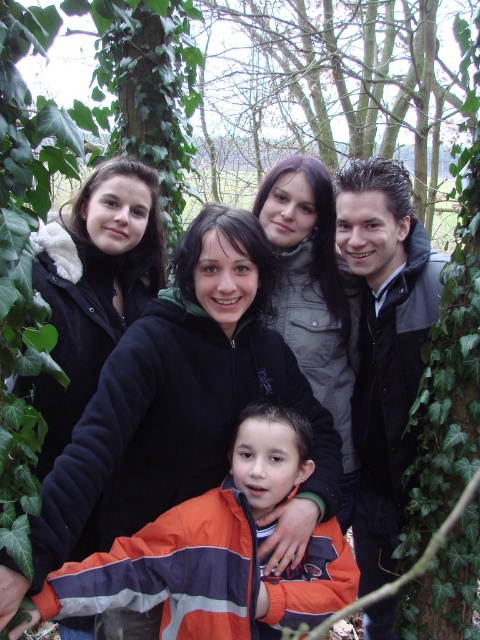
Can you confirm if orange fleece jacket at lower center is positioned to the left of matte gray jacket at upper center?

Indeed, orange fleece jacket at lower center is positioned on the left side of matte gray jacket at upper center.

What do you see at coordinates (217, 552) in the screenshot?
I see `orange fleece jacket at lower center` at bounding box center [217, 552].

The image size is (480, 640). What are the coordinates of `orange fleece jacket at lower center` in the screenshot? It's located at (217, 552).

What are the coordinates of `orange fleece jacket at lower center` in the screenshot? It's located at (217, 552).

Is black fuzzy jacket at upper left thinner than matte gray jacket at upper center?

Correct, black fuzzy jacket at upper left's width is less than matte gray jacket at upper center's.

Between black fuzzy jacket at upper left and matte gray jacket at upper center, which one appears on the right side from the viewer's perspective?

matte gray jacket at upper center is more to the right.

You are a GUI agent. You are given a task and a screenshot of the screen. Output one action in this format:
    pyautogui.click(x=<x>, y=<y>)
    Task: Click on the black fuzzy jacket at upper left
    
    Given the screenshot: What is the action you would take?
    pyautogui.click(x=94, y=285)

Between point (186, 540) and point (123, 282), which one is positioned behind?

Point (123, 282)

Measure the distance from orange fleece jacket at lower center to black fuzzy jacket at upper left.

orange fleece jacket at lower center and black fuzzy jacket at upper left are 35.22 inches apart from each other.

Is point (245, 438) closer to viewer compared to point (88, 301)?

Yes, it is.

You are a GUI agent. You are given a task and a screenshot of the screen. Output one action in this format:
    pyautogui.click(x=<x>, y=<y>)
    Task: Click on the orange fleece jacket at lower center
    The width and height of the screenshot is (480, 640).
    Given the screenshot: What is the action you would take?
    pyautogui.click(x=217, y=552)